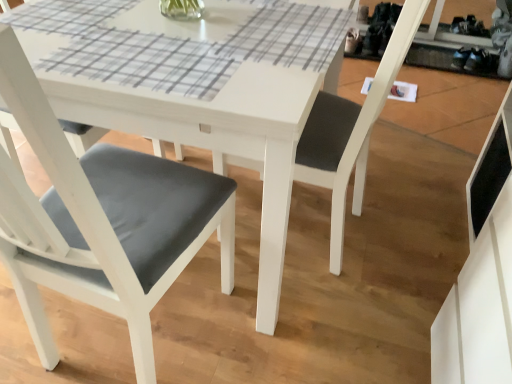
Question: Is matte gray cushion at lower left, which appears as the 2th chair when viewed from the right, in front of or behind matte gray cushion at center, which is the 1th chair from right to left, in the image?

Choices:
 (A) front
 (B) behind

Answer: (A)

Question: Considering the positions of matte gray cushion at lower left, which appears as the 2th chair when viewed from the right, and matte gray cushion at center, the second chair viewed from the left, in the image, is matte gray cushion at lower left, which appears as the 2th chair when viewed from the right, wider or thinner than matte gray cushion at center, the second chair viewed from the left,?

Choices:
 (A) thin
 (B) wide

Answer: (B)

Question: Considering the positions of point (122, 208) and point (325, 175), is point (122, 208) closer or farther from the camera than point (325, 175)?

Choices:
 (A) closer
 (B) farther

Answer: (A)

Question: Visually, is matte gray cushion at center, which is the 1th chair from right to left, positioned to the left or to the right of matte gray cushion at lower left, which appears as the 2th chair when viewed from the right?

Choices:
 (A) right
 (B) left

Answer: (A)

Question: Is matte gray cushion at center, the second chair viewed from the left, taller or shorter than matte gray cushion at lower left, placed as the first chair when sorted from left to right?

Choices:
 (A) tall
 (B) short

Answer: (A)

Question: Is matte gray cushion at center, which is the 1th chair from right to left, in front of or behind matte gray cushion at lower left, which appears as the 2th chair when viewed from the right, in the image?

Choices:
 (A) behind
 (B) front

Answer: (A)

Question: Is point (343, 112) positioned closer to the camera than point (81, 281)?

Choices:
 (A) farther
 (B) closer

Answer: (A)